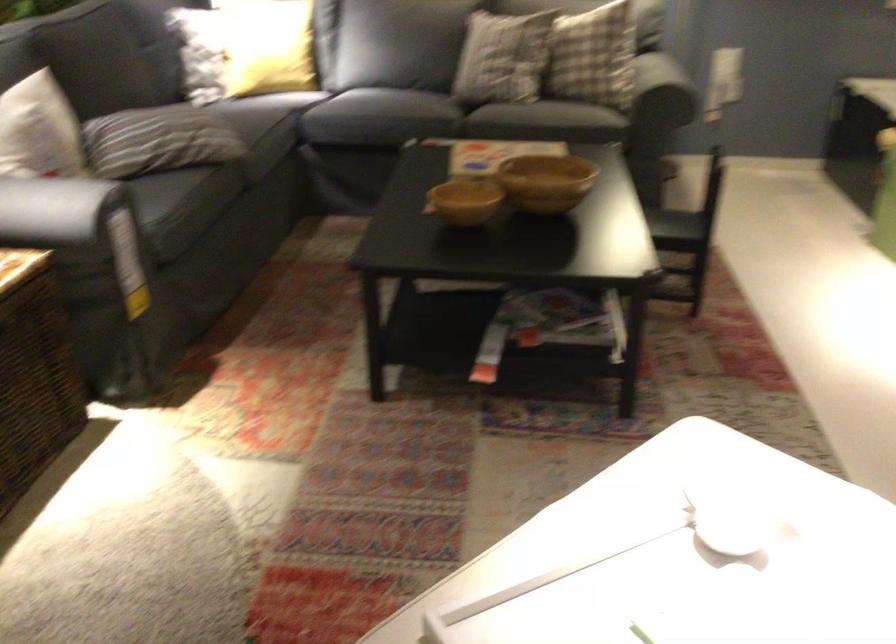
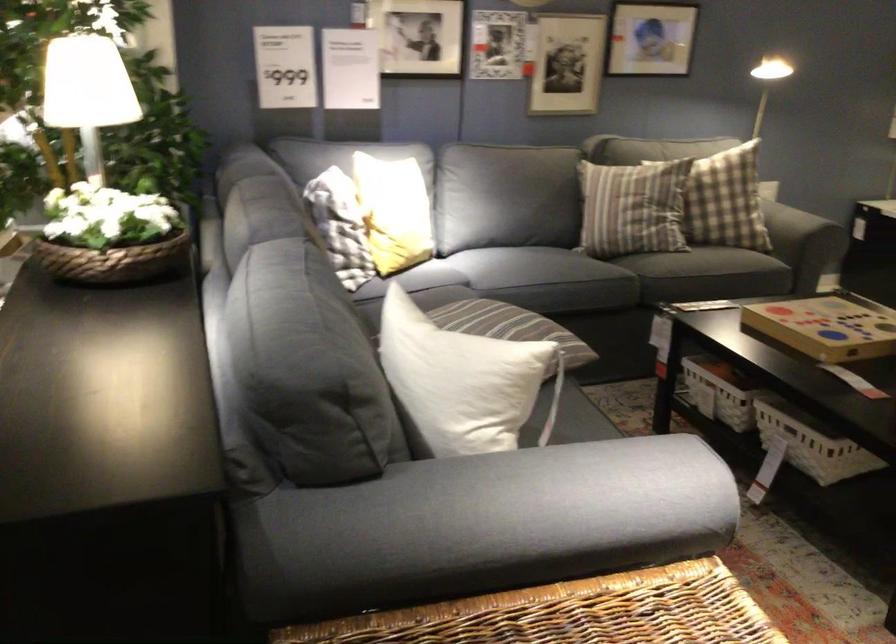
Where in the second image is the point corresponding to pixel 573 79 from the first image?

(798, 223)